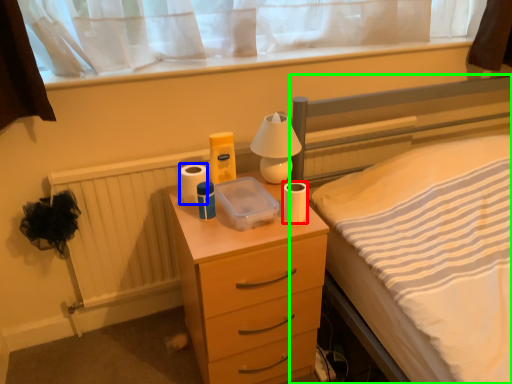
Question: Based on their relative distances, which object is farther from toilet paper (highlighted by a red box)? Choose from toilet paper (highlighted by a blue box) and bed (highlighted by a green box).

Choices:
 (A) toilet paper
 (B) bed

Answer: (B)